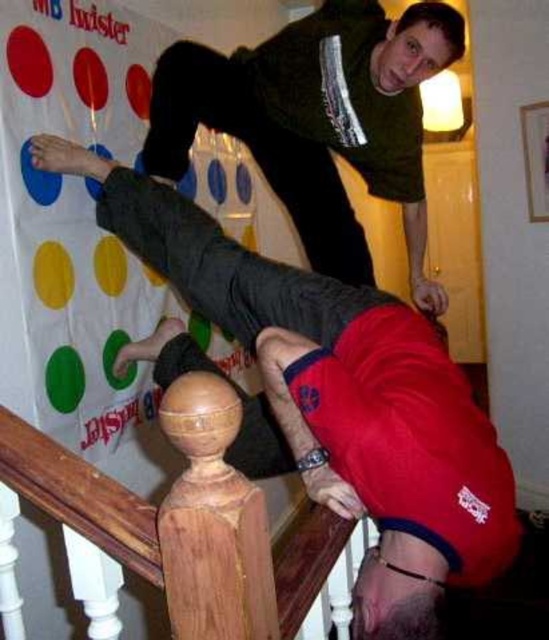
You are a photographer trying to capture a candid shot of the Twister game. You notice the matte black pants at lower center and the matte green sweater at upper center. Which object should you focus on to ensure the subject in the foreground is properly in frame?

The matte black pants at lower center should be focused on because it is positioned under the matte green sweater at upper center, making it the foreground subject.

You are a photographer standing at the base of the staircase. You want to take a photo of the Twister game setup. The point of interest is at coordinates point [255,317]. If your camera has a focal length of 50mm and you want to ensure the point is in focus, what is the minimum distance you should be from the staircase?

The distance of point [255,317] from the camera is 1.55 meters. To ensure the point is in focus, you should be at least 1.55 meters away from the staircase.